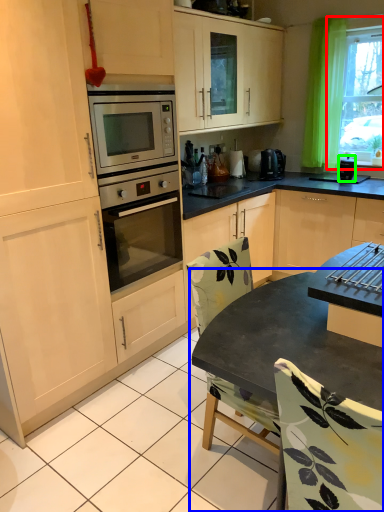
Question: Which object is the closest to the window (highlighted by a red box)? Choose among these: table (highlighted by a blue box) or appliance (highlighted by a green box).

Choices:
 (A) table
 (B) appliance

Answer: (B)